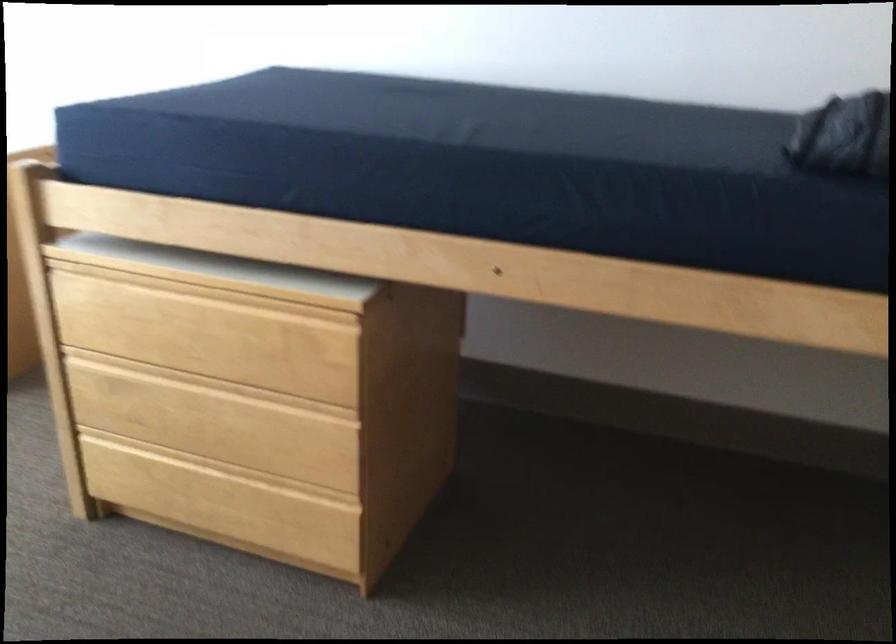
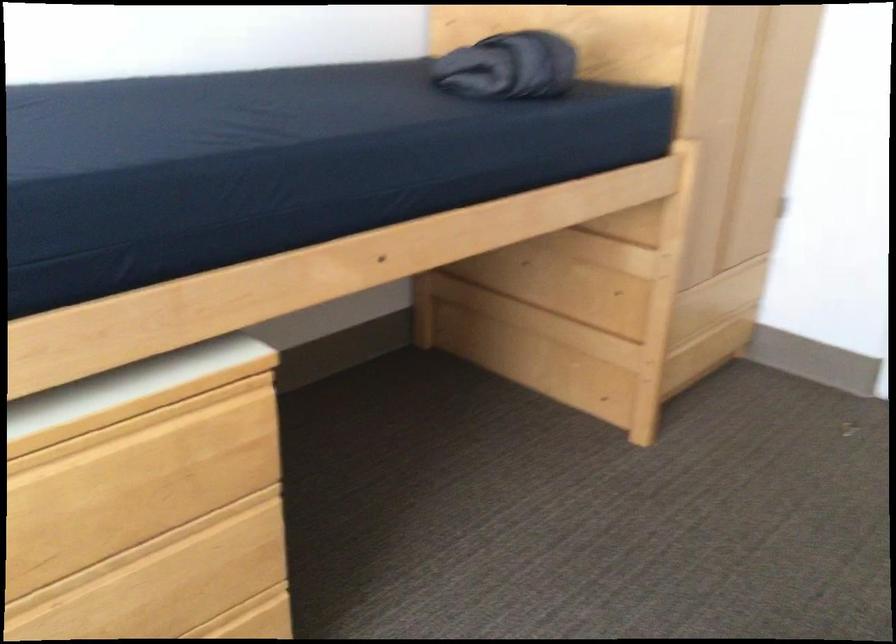
Find the pixel in the second image that matches (268,395) in the first image.

(135, 554)